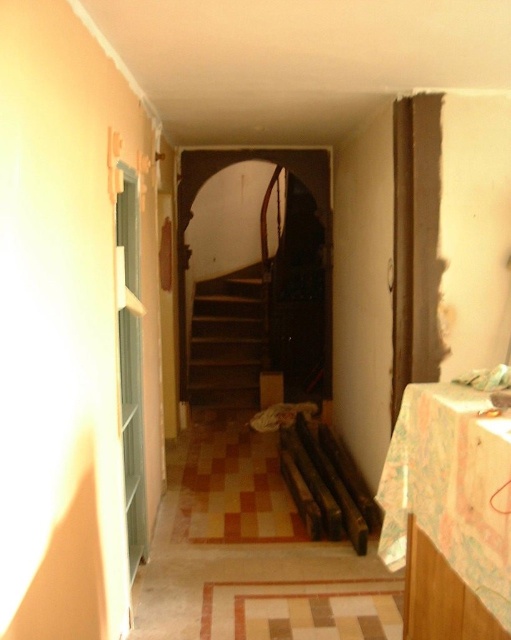
Question: Which point is closer to the camera?

Choices:
 (A) wooden at center
 (B) wooden stairs at center

Answer: (A)

Question: Does wooden stairs at center appear on the right side of wooden at center?

Choices:
 (A) no
 (B) yes

Answer: (A)

Question: Can you confirm if wooden stairs at center is thinner than wooden at center?

Choices:
 (A) yes
 (B) no

Answer: (B)

Question: Which object appears closest to the camera in this image?

Choices:
 (A) wooden stairs at center
 (B) wooden at center

Answer: (B)

Question: Which of the following is the closest to the observer?

Choices:
 (A) wooden stairs at center
 (B) wooden at center

Answer: (B)

Question: Can you confirm if wooden stairs at center is positioned to the right of wooden at center?

Choices:
 (A) yes
 (B) no

Answer: (B)